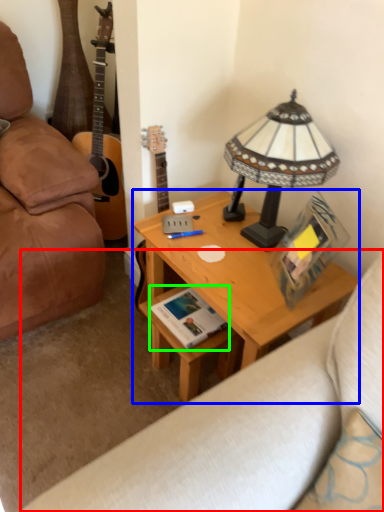
Question: Based on their relative distances, which object is nearer to studio couch (highlighted by a red box)? Choose from desk (highlighted by a blue box) and book (highlighted by a green box).

Choices:
 (A) desk
 (B) book

Answer: (A)